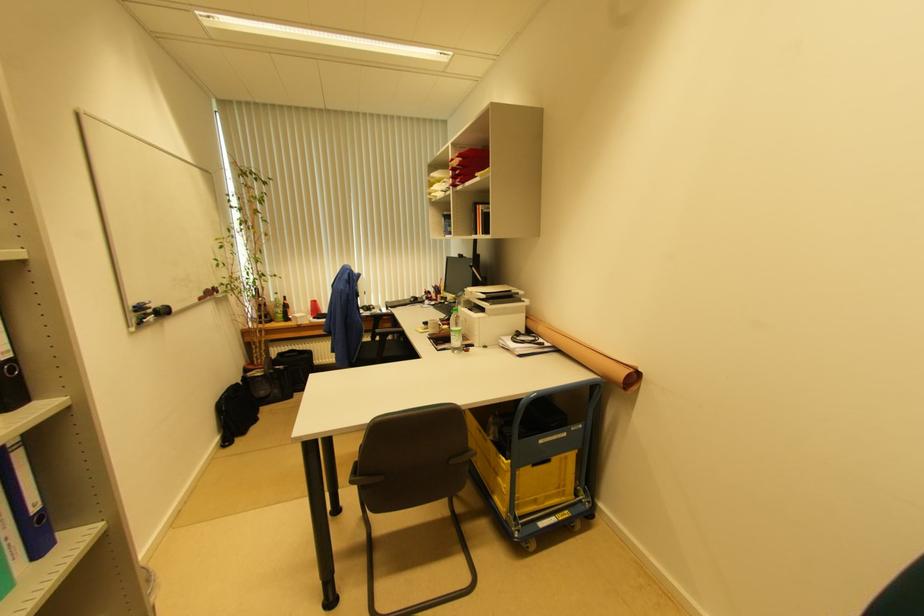
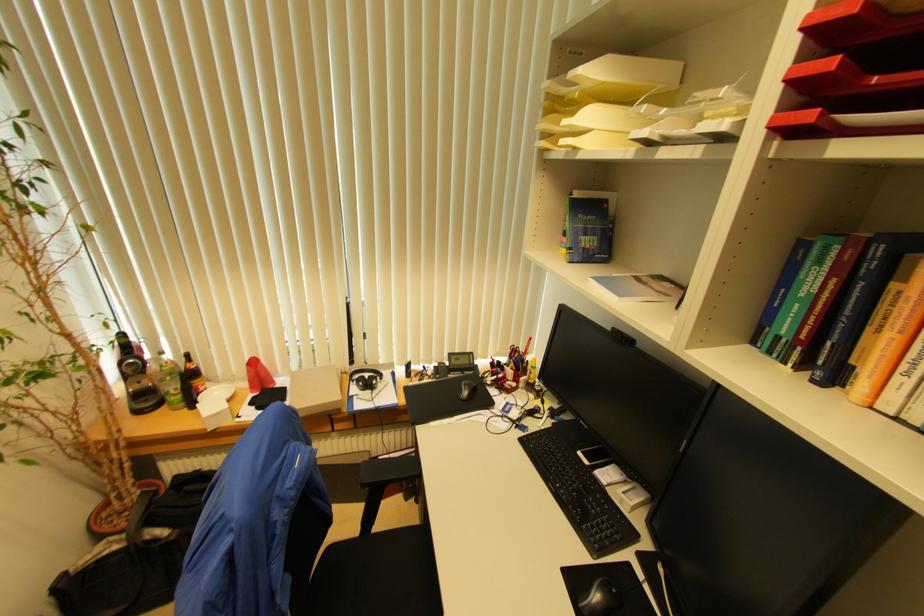
The point at (286, 300) is marked in the first image. Where is the corresponding point in the second image?

(188, 358)